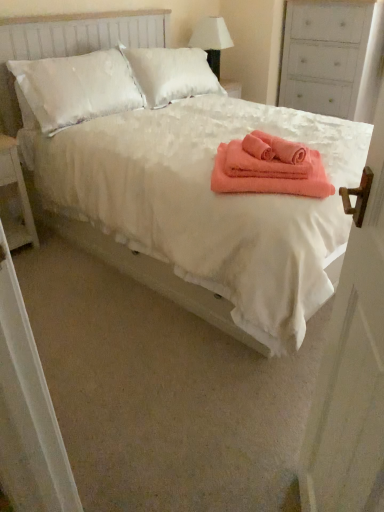
Question: Is coral soft towel at center to the right of white wooden door at right from the viewer's perspective?

Choices:
 (A) yes
 (B) no

Answer: (A)

Question: Does coral soft towel at center have a smaller size compared to white wooden door at right?

Choices:
 (A) yes
 (B) no

Answer: (A)

Question: Is coral soft towel at center not close to white wooden door at right?

Choices:
 (A) yes
 (B) no

Answer: (B)

Question: Does coral soft towel at center have a lesser height compared to white wooden door at right?

Choices:
 (A) no
 (B) yes

Answer: (B)

Question: Is coral soft towel at center closer to camera compared to white wooden door at right?

Choices:
 (A) no
 (B) yes

Answer: (A)

Question: Based on their positions, is white wooden door at right located to the left or right of coral soft towel at center?

Choices:
 (A) right
 (B) left

Answer: (B)

Question: Is white wooden door at right in front of or behind coral soft towel at center in the image?

Choices:
 (A) front
 (B) behind

Answer: (A)

Question: Considering the positions of white wooden door at right and coral soft towel at center in the image, is white wooden door at right taller or shorter than coral soft towel at center?

Choices:
 (A) tall
 (B) short

Answer: (A)

Question: Do you think white wooden door at right is within coral soft towel at center, or outside of it?

Choices:
 (A) inside
 (B) outside

Answer: (B)

Question: Considering their positions, is white wooden door at right located in front of or behind white fabric lampshade at upper center?

Choices:
 (A) front
 (B) behind

Answer: (A)

Question: From the image's perspective, is white wooden door at right positioned above or below white fabric lampshade at upper center?

Choices:
 (A) below
 (B) above

Answer: (A)

Question: Considering the positions of point (347, 463) and point (233, 45), is point (347, 463) closer or farther from the camera than point (233, 45)?

Choices:
 (A) closer
 (B) farther

Answer: (A)

Question: Considering the positions of white wooden door at right and white fabric lampshade at upper center in the image, is white wooden door at right wider or thinner than white fabric lampshade at upper center?

Choices:
 (A) wide
 (B) thin

Answer: (B)

Question: Based on their sizes in the image, would you say coral soft towel at center is bigger or smaller than white painted wood dresser at upper right?

Choices:
 (A) big
 (B) small

Answer: (B)

Question: In terms of height, does coral soft towel at center look taller or shorter compared to white painted wood dresser at upper right?

Choices:
 (A) short
 (B) tall

Answer: (A)